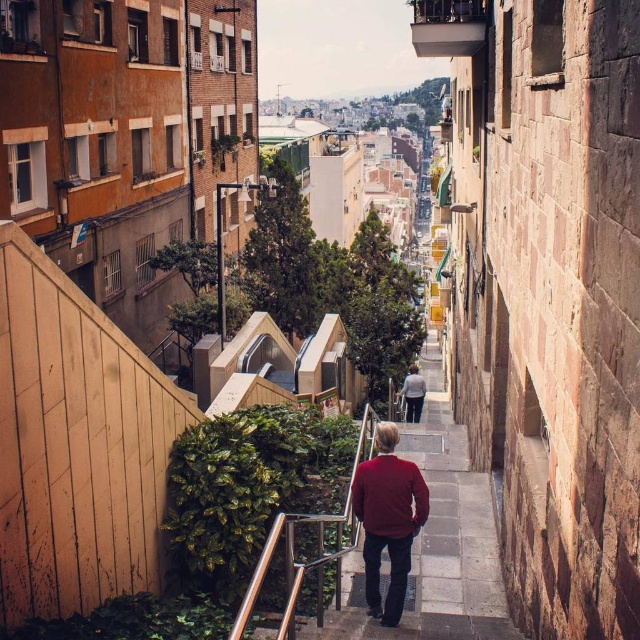
Between matte red sweater at center and light blue denim jacket at center, which one appears on the left side from the viewer's perspective?

matte red sweater at center

Locate an element on the screen. The height and width of the screenshot is (640, 640). matte red sweater at center is located at coordinates (387, 518).